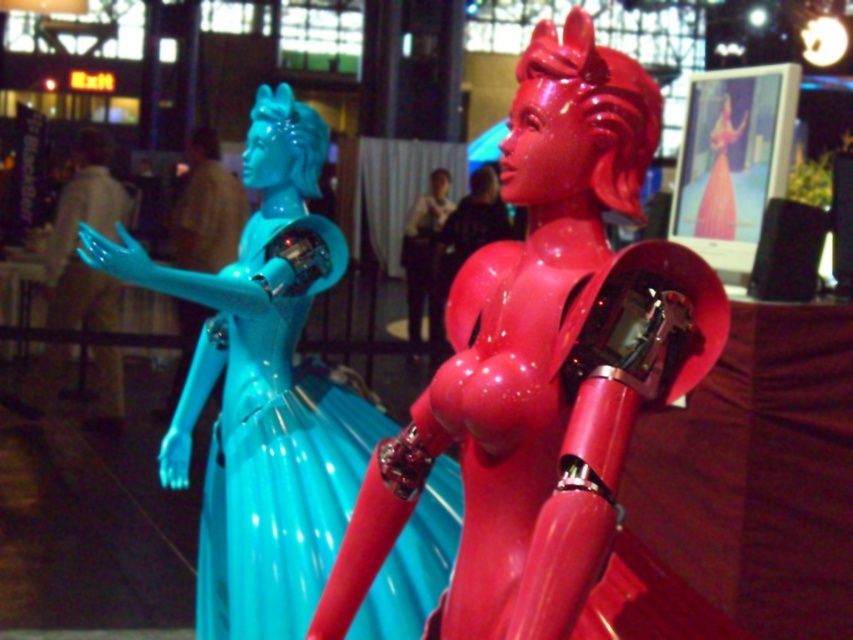
Question: Estimate the real-world distances between objects in this image. Which object is farther from the glossy plastic statue at left?

Choices:
 (A) glossy plastic woman at center
 (B) glossy plastic doll at center

Answer: (A)

Question: Which point is farther from the camera taking this photo?

Choices:
 (A) (169, 280)
 (B) (683, 625)

Answer: (A)

Question: Which of the following is the farthest from the observer?

Choices:
 (A) (500, 365)
 (B) (438, 266)
 (C) (277, 392)

Answer: (B)

Question: Does glossy plastic statue at left appear on the left side of glossy plastic woman at center?

Choices:
 (A) no
 (B) yes

Answer: (B)

Question: Can you confirm if glossy plastic doll at center is positioned below glossy plastic statue at left?

Choices:
 (A) no
 (B) yes

Answer: (A)

Question: Can you confirm if glossy plastic statue at left is smaller than glossy plastic woman at center?

Choices:
 (A) no
 (B) yes

Answer: (A)